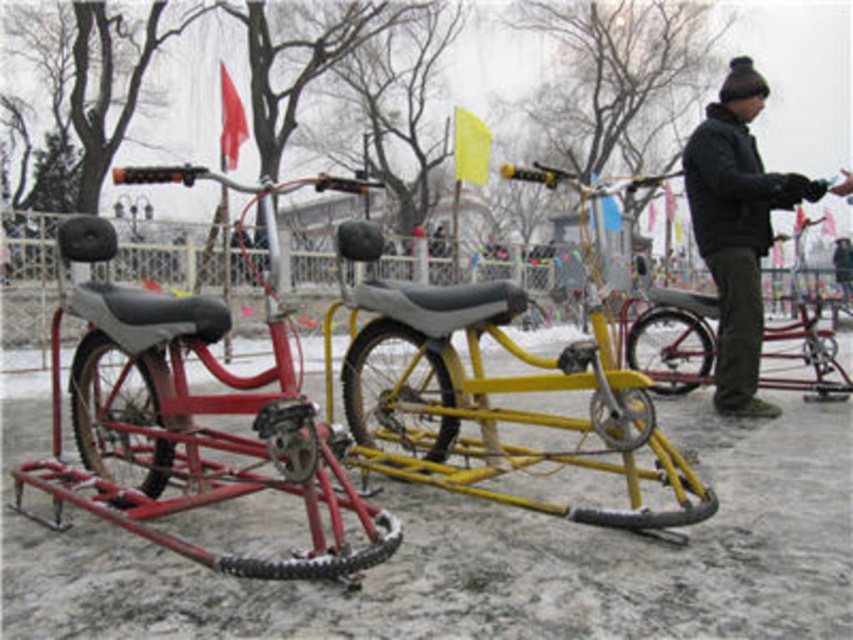
Question: Which object is positioned farthest from the yellow matte bicycle at right?

Choices:
 (A) yellow matte bicycle at center
 (B) matte red bicycle at left

Answer: (B)

Question: Estimate the real-world distances between objects in this image. Which object is farther from the yellow matte bicycle at right?

Choices:
 (A) matte red bicycle at left
 (B) black matte jacket at upper right
 (C) yellow matte bicycle at center

Answer: (A)

Question: Is black matte jacket at upper right above yellow matte bicycle at right?

Choices:
 (A) yes
 (B) no

Answer: (B)

Question: Is matte red bicycle at left to the left of yellow matte bicycle at right from the viewer's perspective?

Choices:
 (A) yes
 (B) no

Answer: (A)

Question: Can you confirm if black matte jacket at upper right is positioned above yellow matte bicycle at right?

Choices:
 (A) yes
 (B) no

Answer: (B)

Question: Which object is the closest to the black matte jacket at upper right?

Choices:
 (A) yellow matte bicycle at right
 (B) matte red bicycle at left
 (C) yellow matte bicycle at center

Answer: (C)